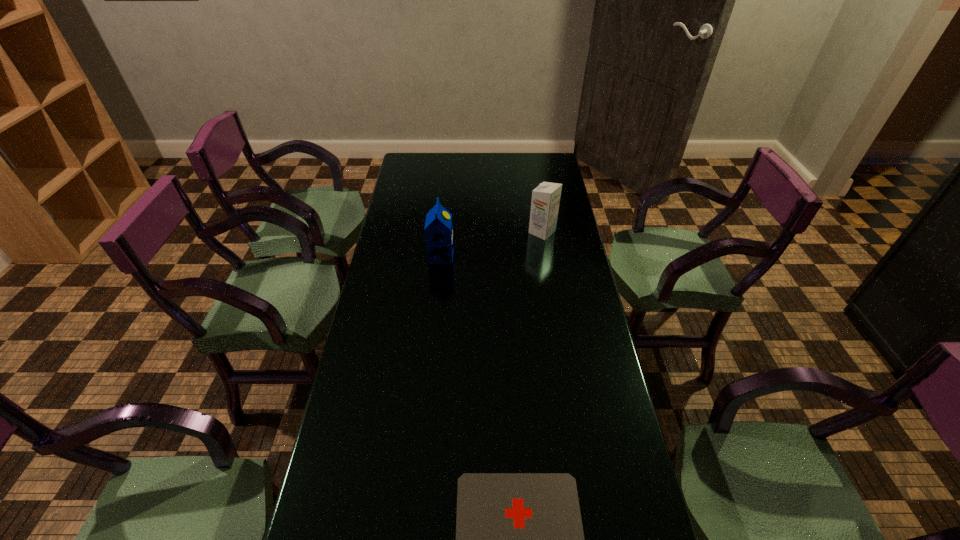
Locate an element on the screen. The image size is (960, 540). free space at the far left corner is located at coordinates (413, 166).

Image resolution: width=960 pixels, height=540 pixels. I want to click on vacant space at the far right corner of the desktop, so click(x=526, y=163).

The height and width of the screenshot is (540, 960). Identify the location of vacant area that lies between the right carton and the left carton. (492, 244).

Locate an element on the screen. empty space between the right carton and the leftmost object is located at coordinates (492, 244).

Identify which object is located as the nearest to the farther carton. Please provide its 2D coordinates. Your answer should be formatted as a tuple, i.e. [(x, y)], where the tuple contains the x and y coordinates of a point satisfying the conditions above.

[(438, 230)]

The image size is (960, 540). I want to click on the second closest object to the leftmost object, so click(519, 537).